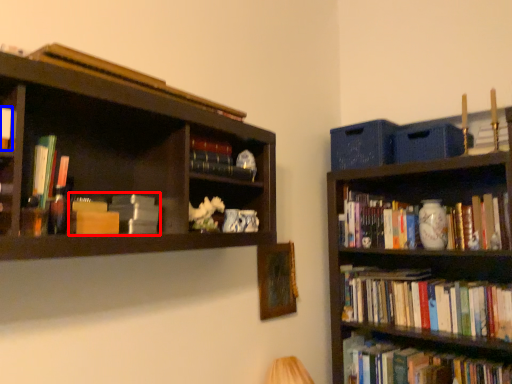
Question: Which object appears closest to the camera in this image, book (highlighted by a red box) or book (highlighted by a blue box)?

Choices:
 (A) book
 (B) book

Answer: (B)